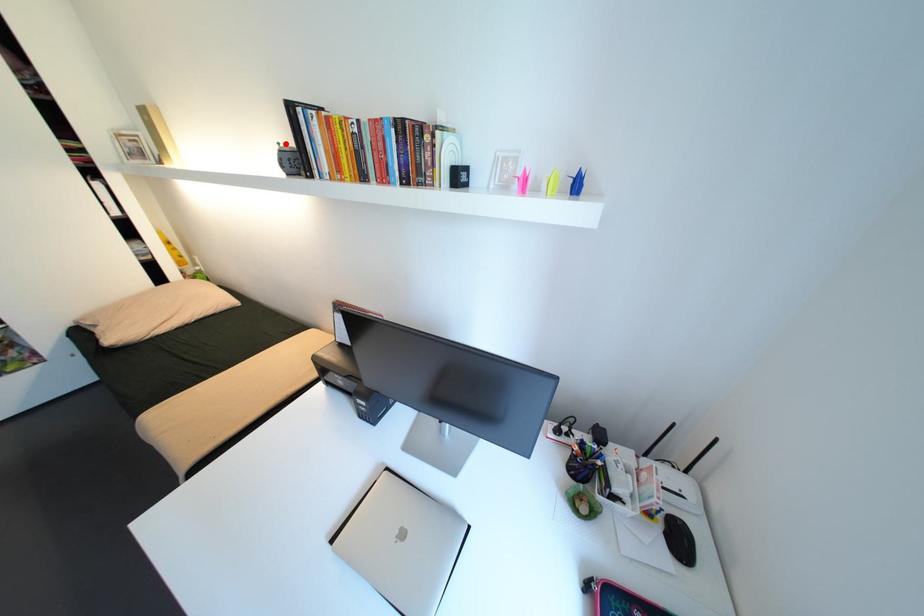
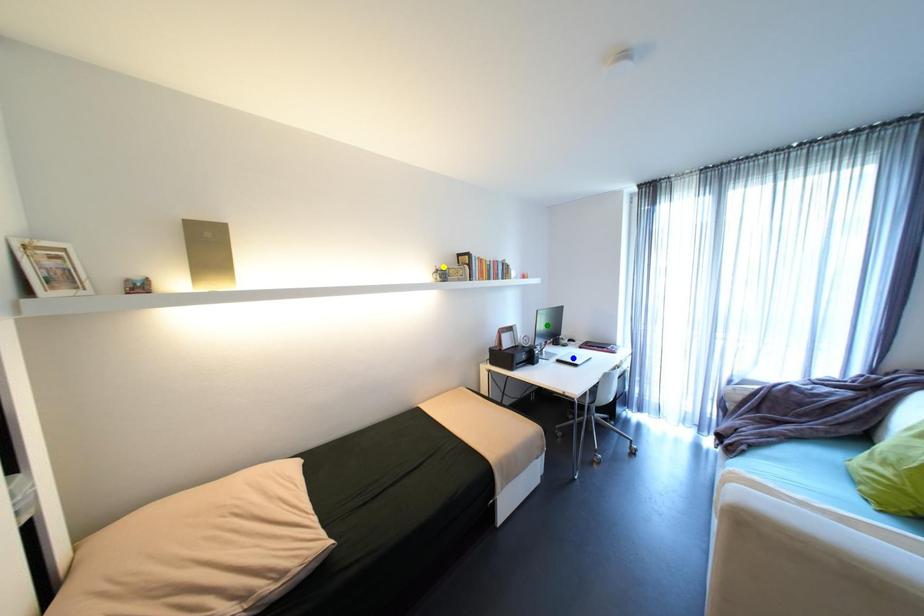
Question: I am providing you with two images of the same scene from different viewpoints. A red point is marked on the first image. You are given multiple points on the second image. In image 2, which mark is for the same physical point as the one in image 1?

Choices:
 (A) yellow point
 (B) blue point
 (C) green point

Answer: (A)